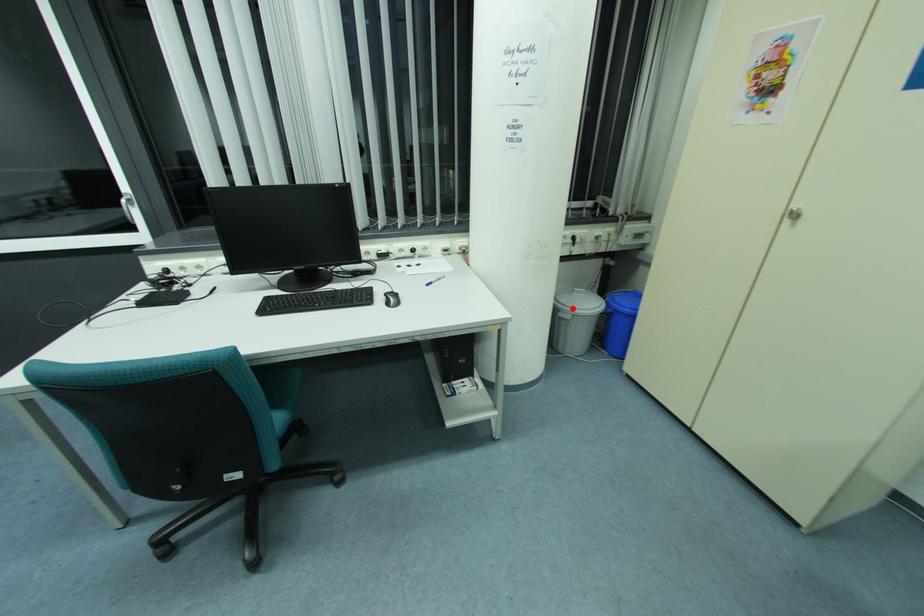
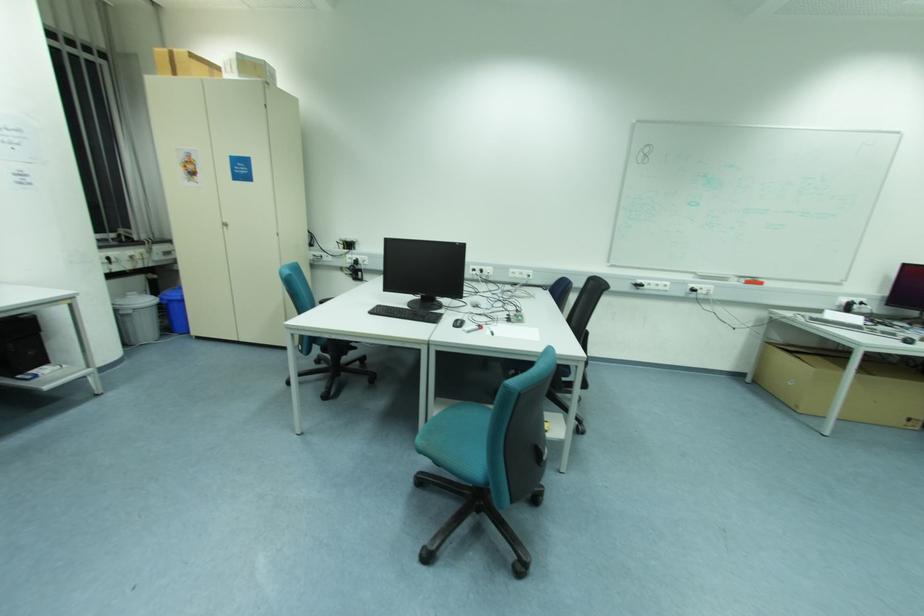
The point at the highlighted location is marked in the first image. Where is the corresponding point in the second image?

(130, 305)